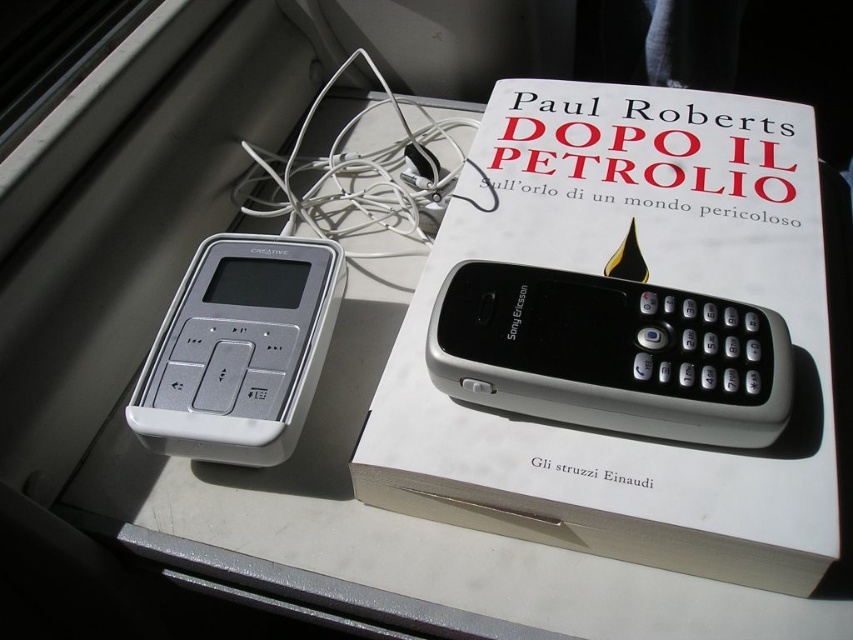
Question: Which point is closer to the camera?

Choices:
 (A) white plastic ipod at upper left
 (B) white matte book at upper center

Answer: (B)

Question: Can you confirm if white matte book at upper center is positioned below black plastic sony ericsson phone at center?

Choices:
 (A) no
 (B) yes

Answer: (A)

Question: Considering the relative positions of white matte book at upper center and white plastic ipod at upper left in the image provided, where is white matte book at upper center located with respect to white plastic ipod at upper left?

Choices:
 (A) left
 (B) right

Answer: (B)

Question: Is black plastic sony ericsson phone at center smaller than white plastic ipod at upper left?

Choices:
 (A) no
 (B) yes

Answer: (B)

Question: Based on their relative distances, which object is nearer to the black plastic sony ericsson phone at center?

Choices:
 (A) white matte book at upper center
 (B) white plastic ipod at upper left

Answer: (A)

Question: Estimate the real-world distances between objects in this image. Which object is farther from the white plastic ipod at upper left?

Choices:
 (A) black plastic sony ericsson phone at center
 (B) white matte book at upper center

Answer: (B)